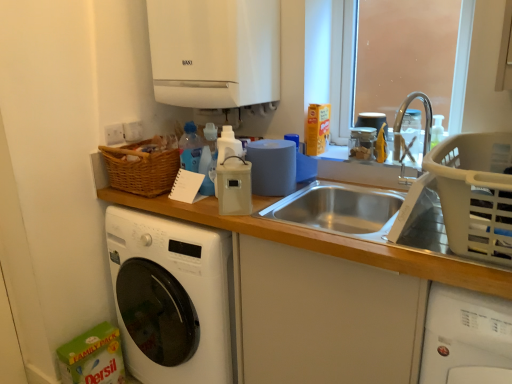
Question: Should I look upward or downward to see white glossy washing machine at lower left, the 1th washing machine from the left?

Choices:
 (A) down
 (B) up

Answer: (A)

Question: Can you confirm if white glossy boiler at upper center, which is the 2th appliance from front to back, is positioned to the right of beige plastic container at center, placed as the 2th appliance when sorted from back to front?

Choices:
 (A) no
 (B) yes

Answer: (A)

Question: Considering the relative sizes of white glossy boiler at upper center, the 1th appliance in the top-to-bottom sequence, and beige plastic container at center, the 1th appliance ordered from the bottom, in the image provided, is white glossy boiler at upper center, the 1th appliance in the top-to-bottom sequence, thinner than beige plastic container at center, the 1th appliance ordered from the bottom,?

Choices:
 (A) yes
 (B) no

Answer: (B)

Question: Does white glossy boiler at upper center, which is the 2th appliance from front to back, have a smaller size compared to beige plastic container at center, the 1th appliance ordered from the bottom?

Choices:
 (A) yes
 (B) no

Answer: (B)

Question: From a real-world perspective, is white glossy boiler at upper center, placed as the first appliance when sorted from back to front, located higher than beige plastic container at center, which ranks as the 2th appliance in top-to-bottom order?

Choices:
 (A) yes
 (B) no

Answer: (A)

Question: Does white glossy boiler at upper center, which ranks as the 2th appliance in bottom-to-top order, lie behind beige plastic container at center, which is counted as the first appliance, starting from the front?

Choices:
 (A) no
 (B) yes

Answer: (B)

Question: Considering the relative sizes of white glossy boiler at upper center, placed as the first appliance when sorted from back to front, and beige plastic container at center, the 1th appliance ordered from the bottom, in the image provided, is white glossy boiler at upper center, placed as the first appliance when sorted from back to front, bigger than beige plastic container at center, the 1th appliance ordered from the bottom,?

Choices:
 (A) yes
 (B) no

Answer: (A)

Question: Would you say white glossy washing machine at lower left, the 1th washing machine from the left, contains translucent plastic window screen at upper right?

Choices:
 (A) no
 (B) yes

Answer: (A)

Question: Is white glossy washing machine at lower left, the 1th washing machine from the left, at the left side of translucent plastic window screen at upper right?

Choices:
 (A) yes
 (B) no

Answer: (A)

Question: From the image's perspective, is white glossy washing machine at lower left, the 1th washing machine from the left, under translucent plastic window screen at upper right?

Choices:
 (A) yes
 (B) no

Answer: (A)

Question: Can you confirm if white glossy washing machine at lower left, the 1th washing machine from the left, is taller than translucent plastic window screen at upper right?

Choices:
 (A) yes
 (B) no

Answer: (A)

Question: Is white glossy washing machine at lower left, the 1th washing machine from the left, far from translucent plastic window screen at upper right?

Choices:
 (A) yes
 (B) no

Answer: (A)

Question: Is white glossy washing machine at lower left, the second washing machine viewed from the right, shorter than translucent plastic window screen at upper right?

Choices:
 (A) yes
 (B) no

Answer: (B)

Question: Considering the relative positions of beige plastic container at center, placed as the 2th appliance when sorted from back to front, and white glossy boiler at upper center, placed as the first appliance when sorted from back to front, in the image provided, is beige plastic container at center, placed as the 2th appliance when sorted from back to front, to the right of white glossy boiler at upper center, placed as the first appliance when sorted from back to front, from the viewer's perspective?

Choices:
 (A) no
 (B) yes

Answer: (B)